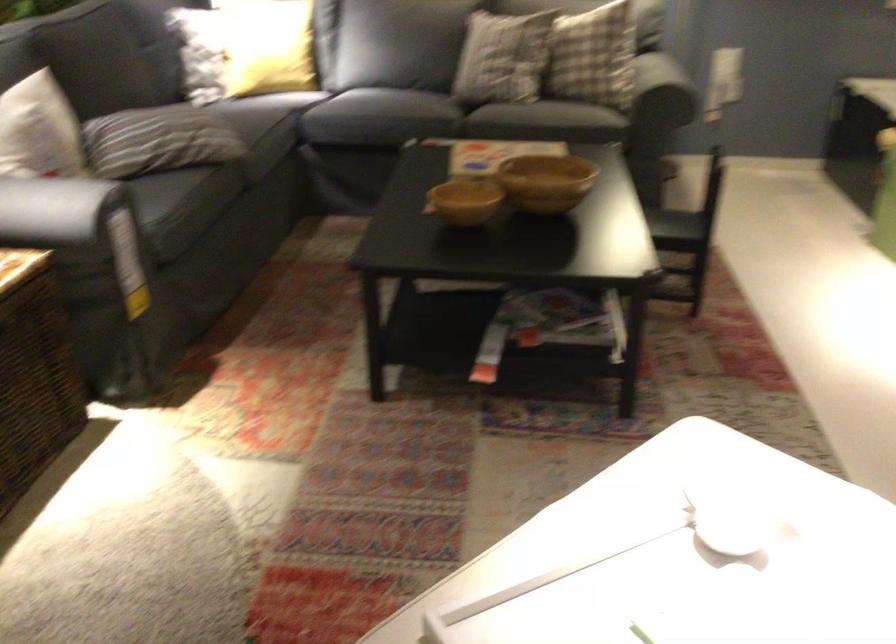
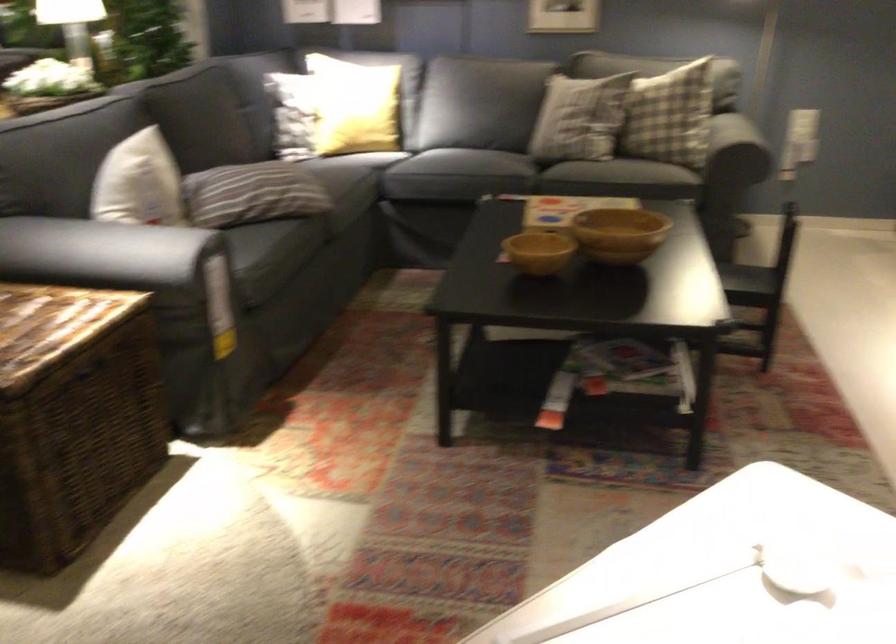
In the second image, find the point that corresponds to [662,96] in the first image.

(735, 152)